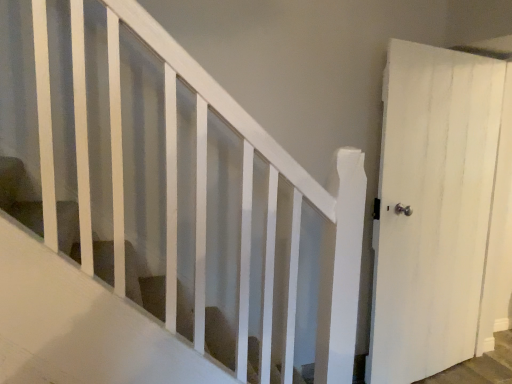
What do you see at coordinates (438, 210) in the screenshot? The width and height of the screenshot is (512, 384). I see `white matte door at right` at bounding box center [438, 210].

What is the approximate width of white matte door at right?

It is 6.37 inches.

Locate an element on the screen. The height and width of the screenshot is (384, 512). white matte door at right is located at coordinates (438, 210).

Identify the location of white matte door at right. This screenshot has height=384, width=512. (438, 210).